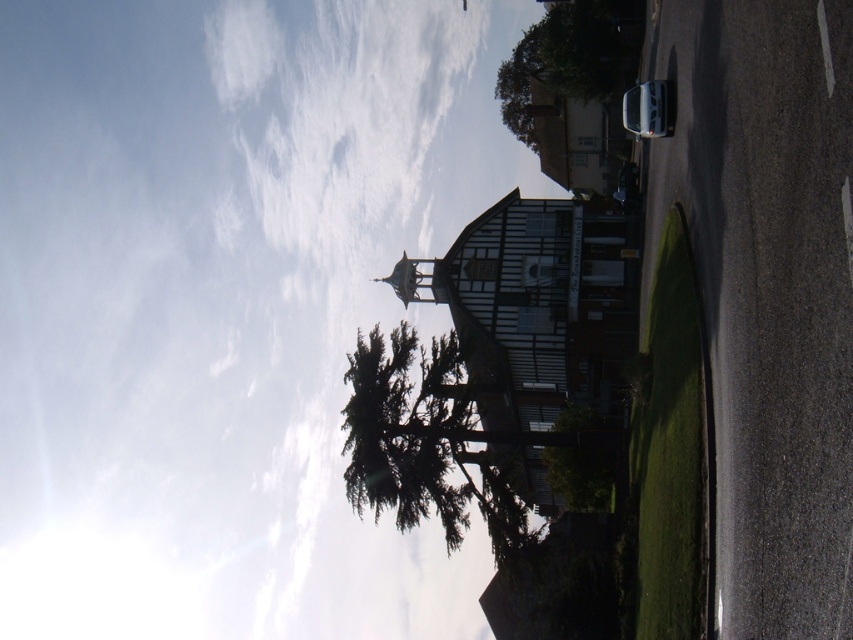
Is point (386, 108) less distant than point (572, 12)?

No, it is not.

Which is more to the left, white fluffy cloud at upper center or green leafy tree at upper center?

white fluffy cloud at upper center

What do you see at coordinates (225, 305) in the screenshot?
I see `white fluffy cloud at upper center` at bounding box center [225, 305].

Find the location of a particular element. This screenshot has width=853, height=640. white fluffy cloud at upper center is located at coordinates (225, 305).

Based on the photo, is green textured tree at center wider than green leafy tree at center?

Correct, the width of green textured tree at center exceeds that of green leafy tree at center.

Can you confirm if green textured tree at center is bigger than green leafy tree at center?

Indeed, green textured tree at center has a larger size compared to green leafy tree at center.

The width and height of the screenshot is (853, 640). What are the coordinates of `green textured tree at center` in the screenshot? It's located at (424, 442).

Is white fluffy cloud at upper center bigger than green leafy tree at center?

Yes, white fluffy cloud at upper center is bigger than green leafy tree at center.

Is the position of white fluffy cloud at upper center less distant than that of green leafy tree at center?

Yes, white fluffy cloud at upper center is closer to the viewer.

Image resolution: width=853 pixels, height=640 pixels. What do you see at coordinates (225, 305) in the screenshot?
I see `white fluffy cloud at upper center` at bounding box center [225, 305].

Identify the location of white fluffy cloud at upper center. This screenshot has height=640, width=853. pos(225,305).